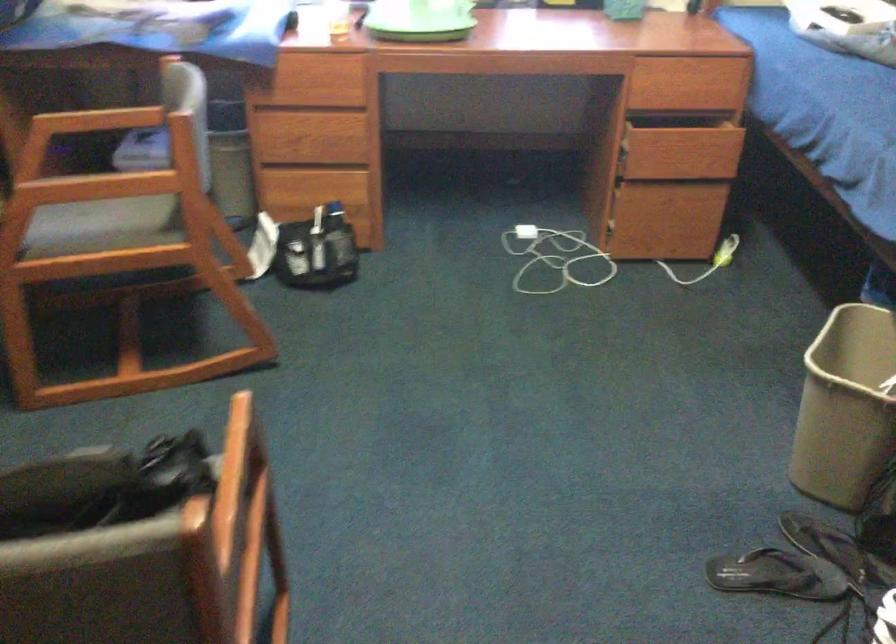
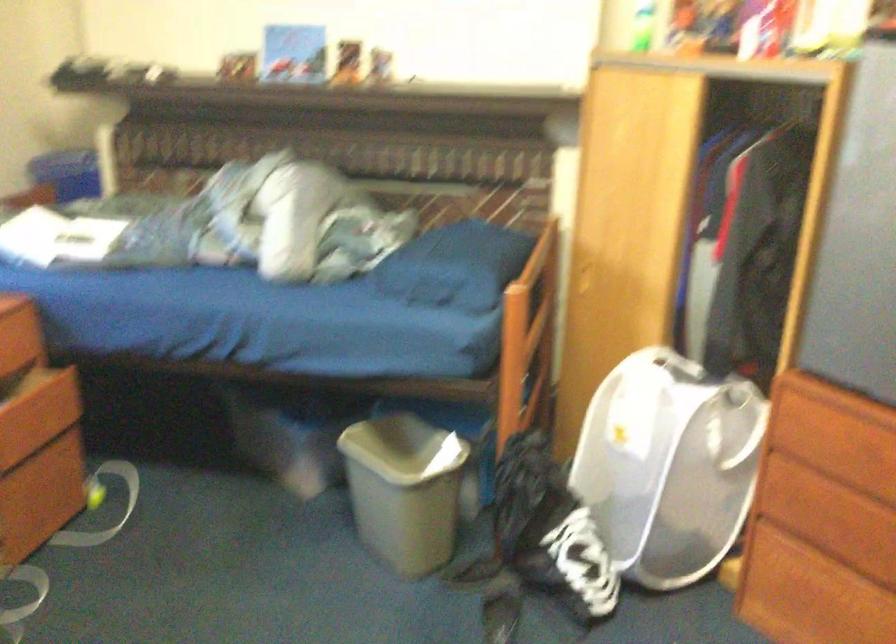
Where in the second image is the point corresponding to [725,76] from the first image?

(19, 332)